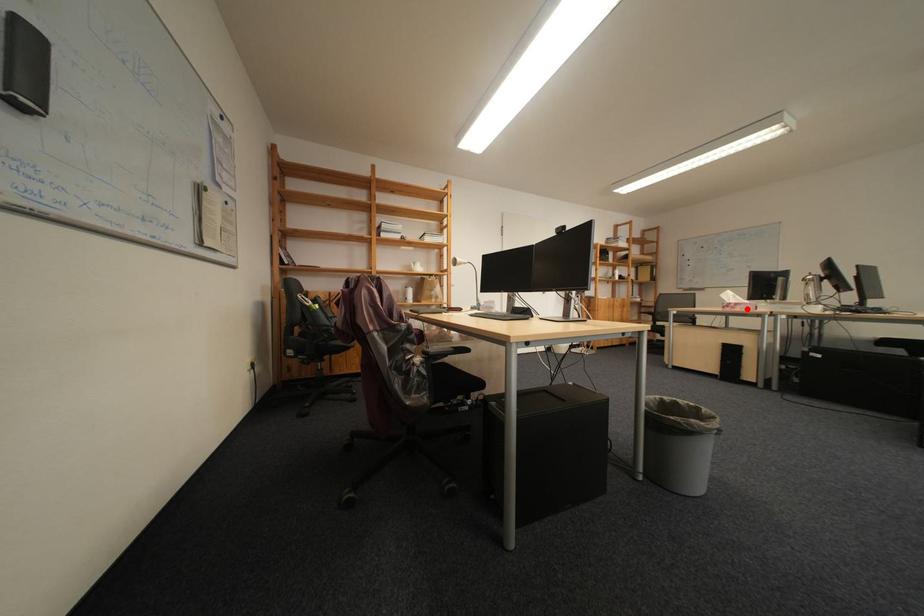
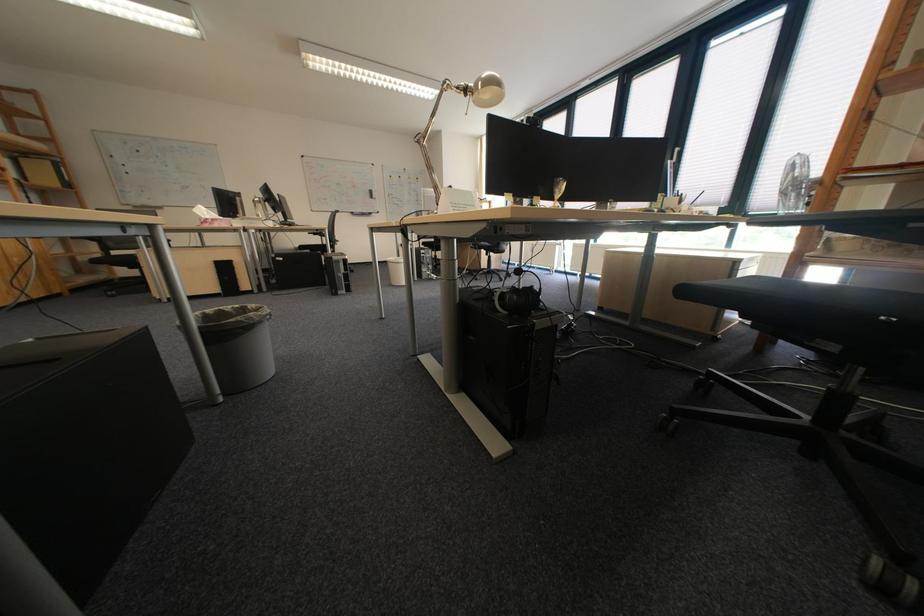
Locate, in the second image, the point that corresponds to the highlighted location in the first image.

(225, 225)